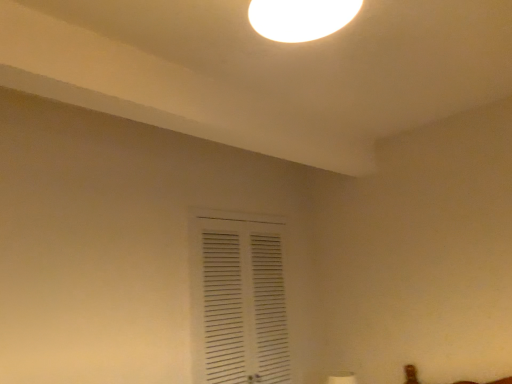
Question: Should I look upward or downward to see white glossy light fixture at upper center?

Choices:
 (A) up
 (B) down

Answer: (A)

Question: Should I look upward or downward to see white matte vent at center?

Choices:
 (A) up
 (B) down

Answer: (B)

Question: From the image's perspective, is white glossy light fixture at upper center located above white matte vent at center?

Choices:
 (A) yes
 (B) no

Answer: (A)

Question: Is white glossy light fixture at upper center looking in the opposite direction of white matte vent at center?

Choices:
 (A) yes
 (B) no

Answer: (B)

Question: From a real-world perspective, is white glossy light fixture at upper center below white matte vent at center?

Choices:
 (A) no
 (B) yes

Answer: (A)

Question: Considering the relative sizes of white glossy light fixture at upper center and white matte vent at center in the image provided, is white glossy light fixture at upper center thinner than white matte vent at center?

Choices:
 (A) no
 (B) yes

Answer: (A)

Question: Considering the relative positions of white glossy light fixture at upper center and white matte vent at center in the image provided, is white glossy light fixture at upper center to the left of white matte vent at center from the viewer's perspective?

Choices:
 (A) yes
 (B) no

Answer: (B)

Question: Could you tell me if white glossy light fixture at upper center is facing white matte vent at center?

Choices:
 (A) no
 (B) yes

Answer: (A)

Question: From the image's perspective, is white matte vent at center on top of white glossy light fixture at upper center?

Choices:
 (A) no
 (B) yes

Answer: (A)

Question: Can you confirm if white matte vent at center is wider than white glossy light fixture at upper center?

Choices:
 (A) yes
 (B) no

Answer: (B)

Question: From a real-world perspective, does white matte vent at center stand above white glossy light fixture at upper center?

Choices:
 (A) no
 (B) yes

Answer: (A)

Question: Can you confirm if white matte vent at center is thinner than white glossy light fixture at upper center?

Choices:
 (A) no
 (B) yes

Answer: (B)

Question: Can you confirm if white matte vent at center is taller than white glossy light fixture at upper center?

Choices:
 (A) yes
 (B) no

Answer: (A)

Question: From the image's perspective, does white matte vent at center appear lower than white glossy light fixture at upper center?

Choices:
 (A) yes
 (B) no

Answer: (A)

Question: From a real-world perspective, relative to white matte vent at center, is white glossy light fixture at upper center vertically above or below?

Choices:
 (A) below
 (B) above

Answer: (B)